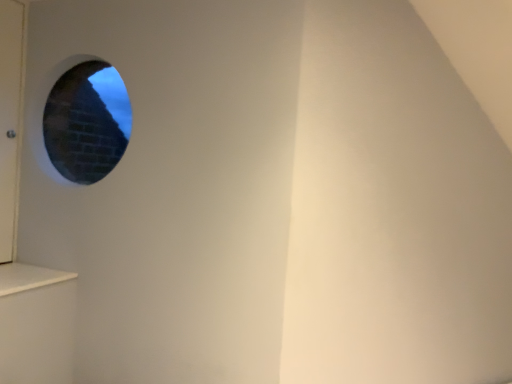
Image resolution: width=512 pixels, height=384 pixels. What are the coordinates of `white matte shelf at lower left` in the screenshot? It's located at (28, 277).

Describe the element at coordinates (28, 277) in the screenshot. The width and height of the screenshot is (512, 384). I see `white matte shelf at lower left` at that location.

Locate an element on the screen. This screenshot has height=384, width=512. white matte shelf at lower left is located at coordinates (28, 277).